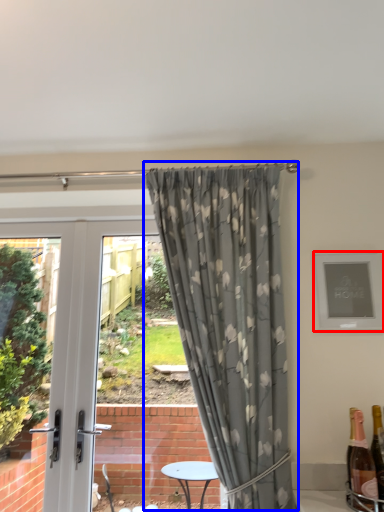
Question: Which object is closer to the camera taking this photo, picture frame (highlighted by a red box) or curtain (highlighted by a blue box)?

Choices:
 (A) picture frame
 (B) curtain

Answer: (B)